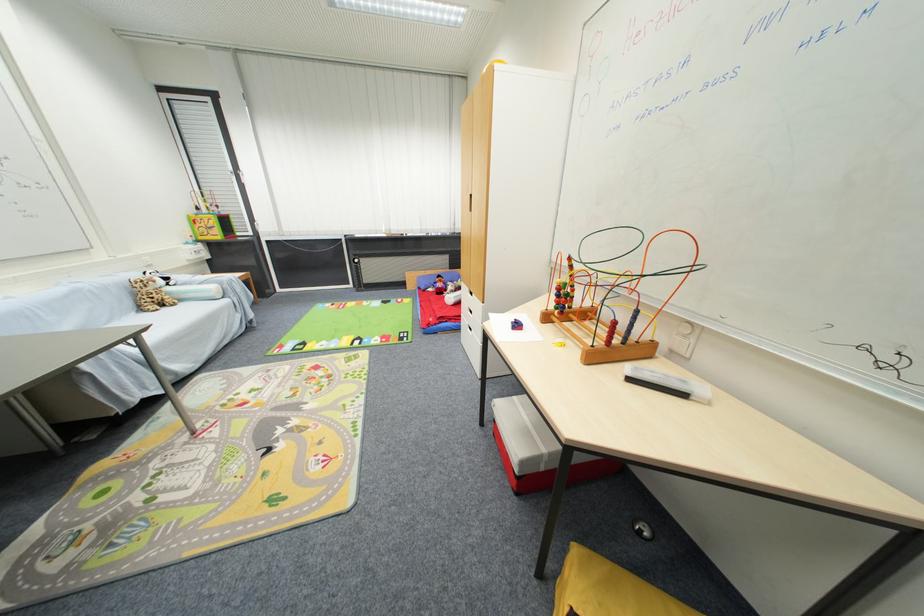
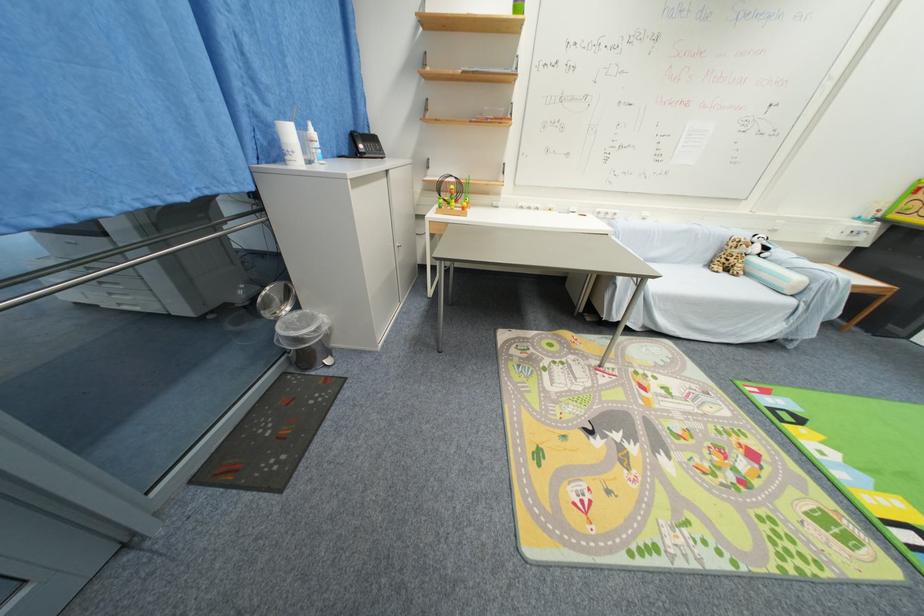
Locate, in the second image, the point that corresponds to point 146,310 in the first image.

(714, 265)